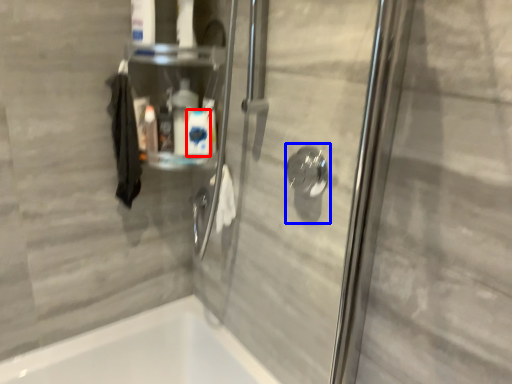
Question: Which object appears farthest to the camera in this image, cleaning product (highlighted by a red box) or shower (highlighted by a blue box)?

Choices:
 (A) cleaning product
 (B) shower

Answer: (A)